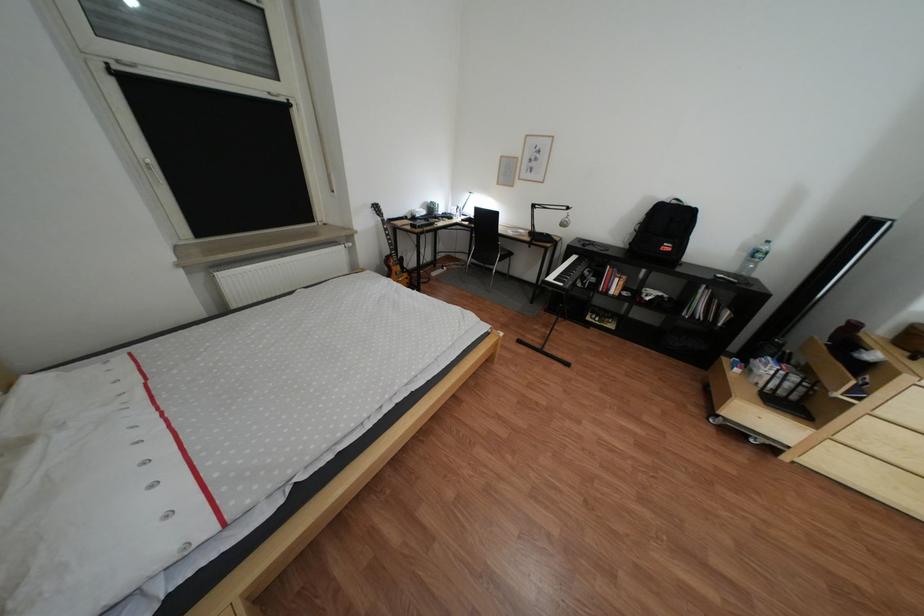
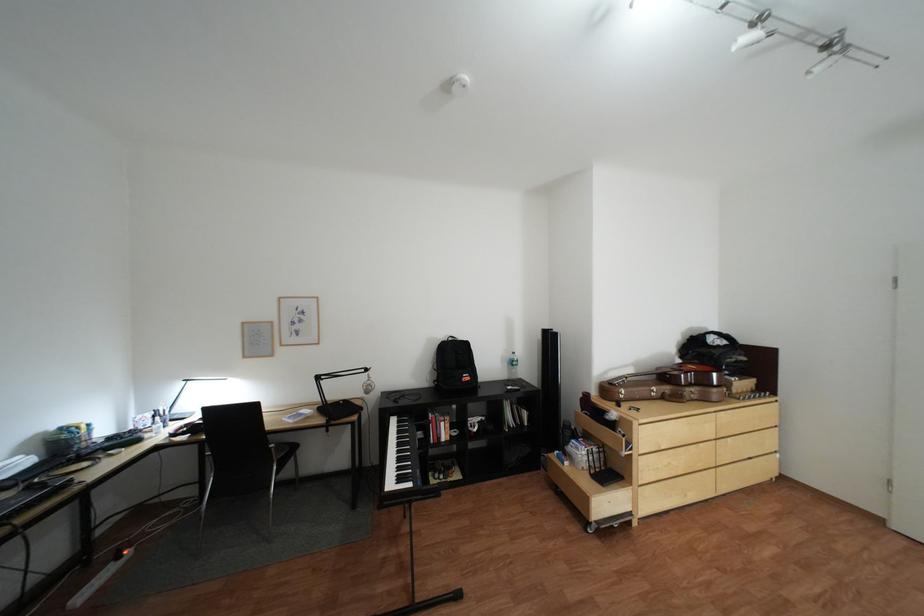
In the second image, find the point that corresponds to (689,203) in the first image.

(466, 339)